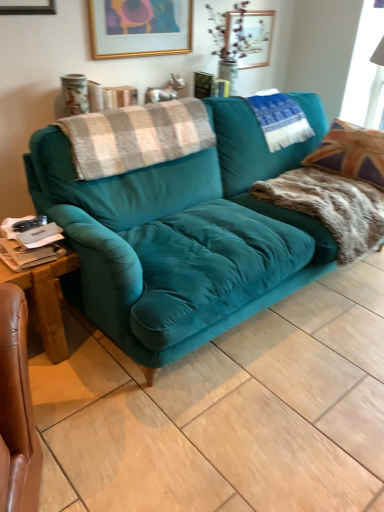
Question: Can you confirm if white fabric at upper right is smaller than fur-like fabric pillow at right?

Choices:
 (A) no
 (B) yes

Answer: (B)

Question: Does white fabric at upper right lie behind fur-like fabric pillow at right?

Choices:
 (A) no
 (B) yes

Answer: (B)

Question: Can we say white fabric at upper right lies outside fur-like fabric pillow at right?

Choices:
 (A) yes
 (B) no

Answer: (A)

Question: Is white fabric at upper right surrounding fur-like fabric pillow at right?

Choices:
 (A) no
 (B) yes

Answer: (A)

Question: Is white fabric at upper right aimed at fur-like fabric pillow at right?

Choices:
 (A) yes
 (B) no

Answer: (A)

Question: Is white fabric at upper right next to fur-like fabric pillow at right?

Choices:
 (A) no
 (B) yes

Answer: (A)

Question: Is teal velvet couch at center facing towards plaid woolen blanket at upper left, which appears as the 2th blanket when viewed from the right?

Choices:
 (A) no
 (B) yes

Answer: (A)

Question: Considering the relative sizes of teal velvet couch at center and plaid woolen blanket at upper left, which appears as the 2th blanket when viewed from the right, in the image provided, is teal velvet couch at center taller than plaid woolen blanket at upper left, which appears as the 2th blanket when viewed from the right,?

Choices:
 (A) yes
 (B) no

Answer: (A)

Question: Is teal velvet couch at center not close to plaid woolen blanket at upper left, the first blanket from the left?

Choices:
 (A) yes
 (B) no

Answer: (B)

Question: Is teal velvet couch at center next to plaid woolen blanket at upper left, which appears as the 2th blanket when viewed from the right, and touching it?

Choices:
 (A) no
 (B) yes

Answer: (A)

Question: Would you say teal velvet couch at center is outside plaid woolen blanket at upper left, the first blanket from the left?

Choices:
 (A) no
 (B) yes

Answer: (B)

Question: Is teal velvet couch at center at the left side of plaid woolen blanket at upper left, the first blanket from the left?

Choices:
 (A) yes
 (B) no

Answer: (B)

Question: Is the position of wooden picture frame at upper center, which appears as the second picture frame when viewed from the left, less distant than that of fur-like fabric pillow at right?

Choices:
 (A) yes
 (B) no

Answer: (B)